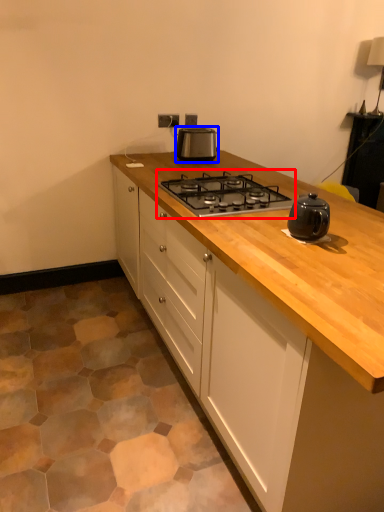
Question: Which object is further to the camera taking this photo, gas stove (highlighted by a red box) or kitchen appliance (highlighted by a blue box)?

Choices:
 (A) gas stove
 (B) kitchen appliance

Answer: (B)